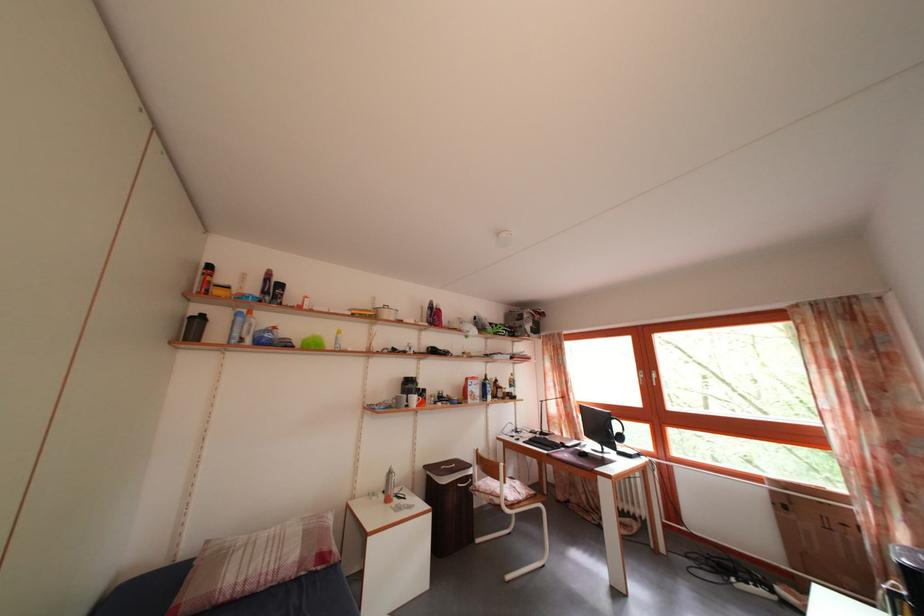
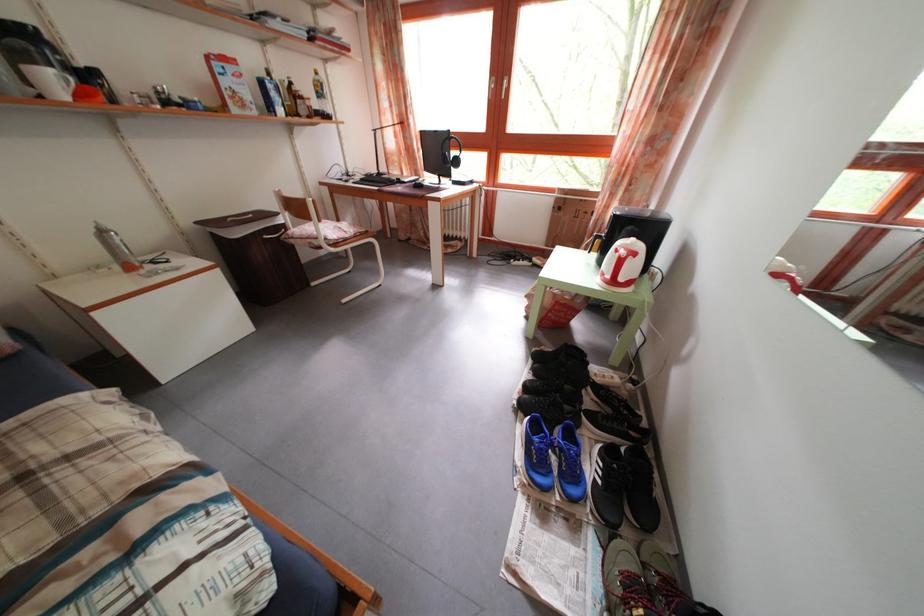
Where in the second image is the point corresponding to [572,442] from the first image?

(412, 182)